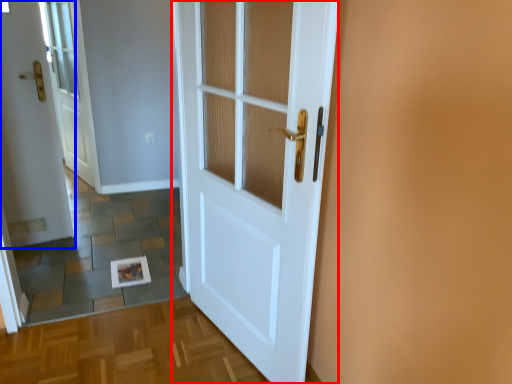
Question: Among these objects, which one is farthest to the camera, door (highlighted by a red box) or door (highlighted by a blue box)?

Choices:
 (A) door
 (B) door

Answer: (B)